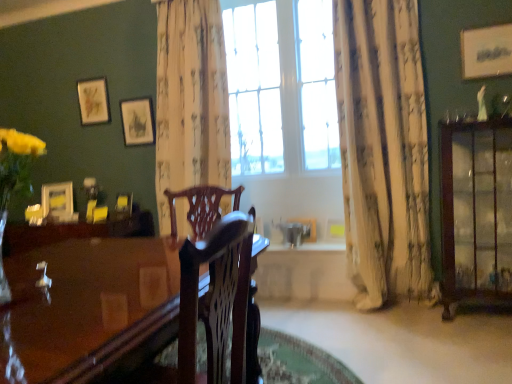
Identify the location of vacant location below white textured curtain at right, which appears as the 1th curtain when viewed from the right (from a real-world perspective). (392, 309).